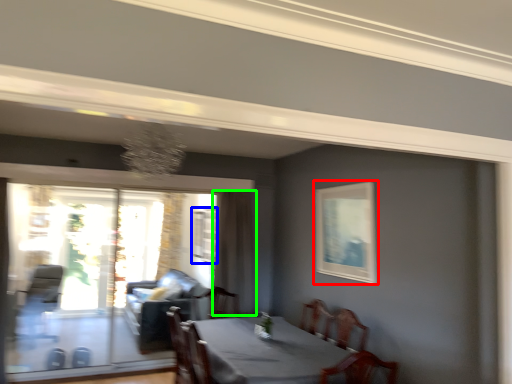
Question: Based on their relative distances, which object is farther from picture frame (highlighted by a red box)? Choose from window (highlighted by a blue box) and curtain (highlighted by a green box).

Choices:
 (A) window
 (B) curtain

Answer: (A)